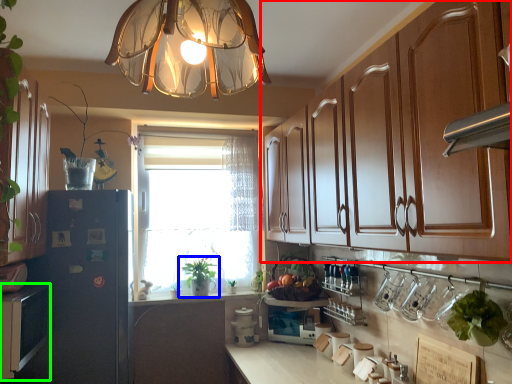
Question: Considering the real-world distances, which object is farthest from cabinetry (highlighted by a red box)? houseplant (highlighted by a blue box) or cabinetry (highlighted by a green box)?

Choices:
 (A) houseplant
 (B) cabinetry

Answer: (B)